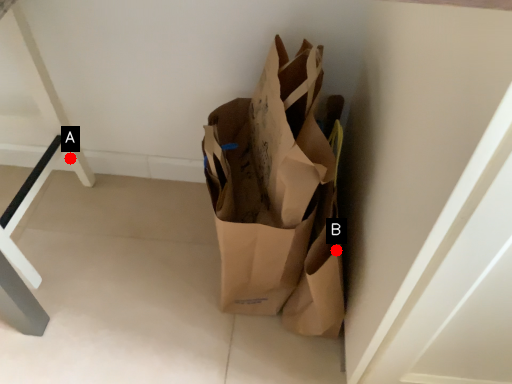
Question: Two points are circled on the image, labeled by A and B beside each circle. Among these points, which one is farthest from the camera?

Choices:
 (A) A is further
 (B) B is further

Answer: (A)